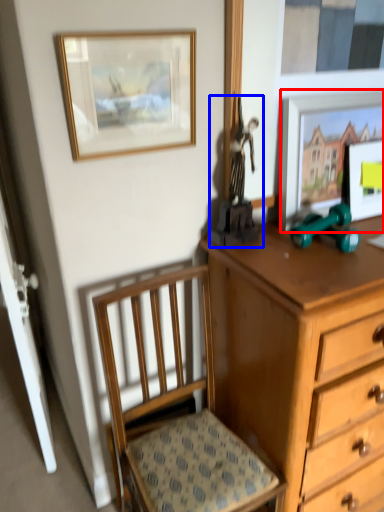
Question: Which of the following is the closest to the observer, picture frame (highlighted by a red box) or toy (highlighted by a blue box)?

Choices:
 (A) picture frame
 (B) toy

Answer: (B)